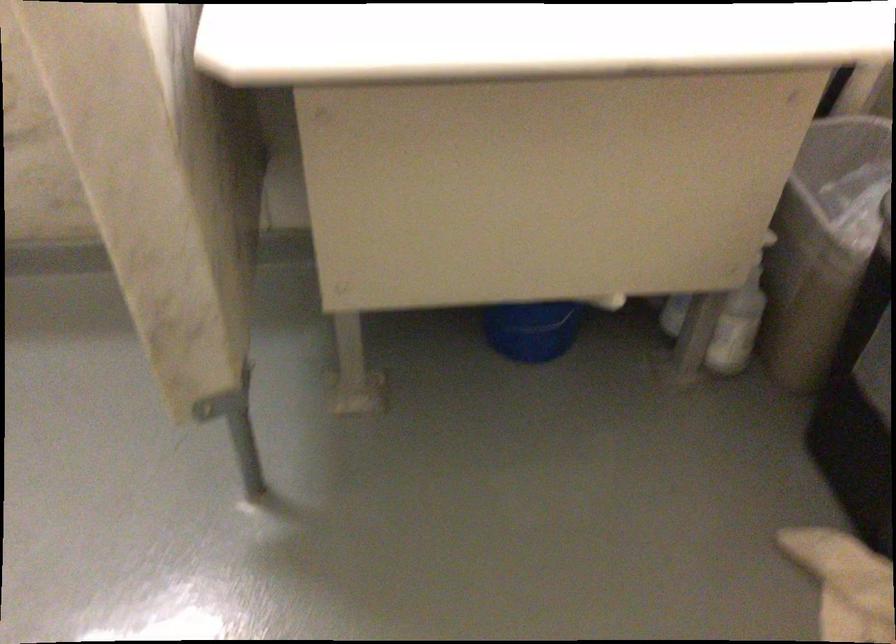
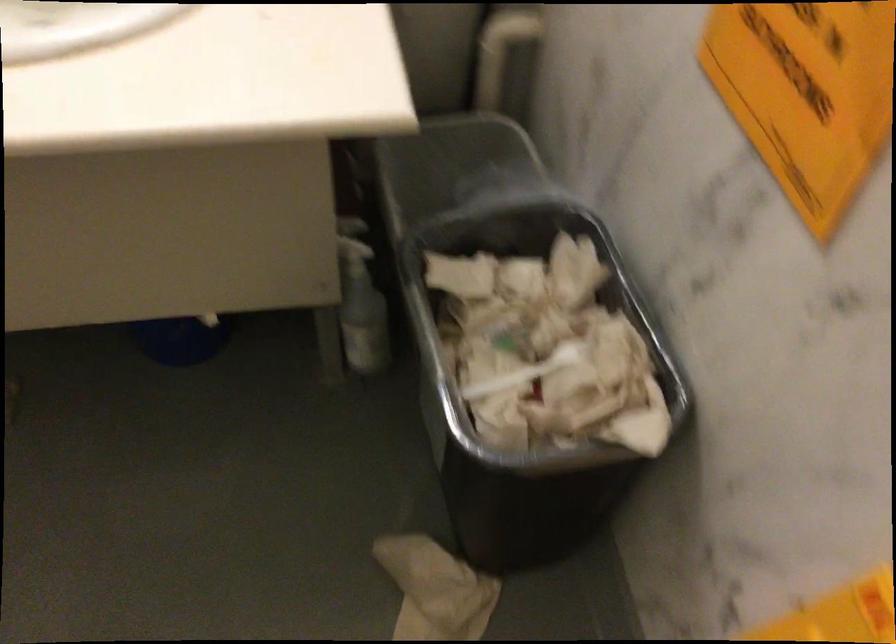
Question: Which direction would the cameraman need to move to produce the second image? Reply with the corresponding letter.

Choices:
 (A) Left
 (B) Right
 (C) Forward
 (D) Backward

Answer: (B)